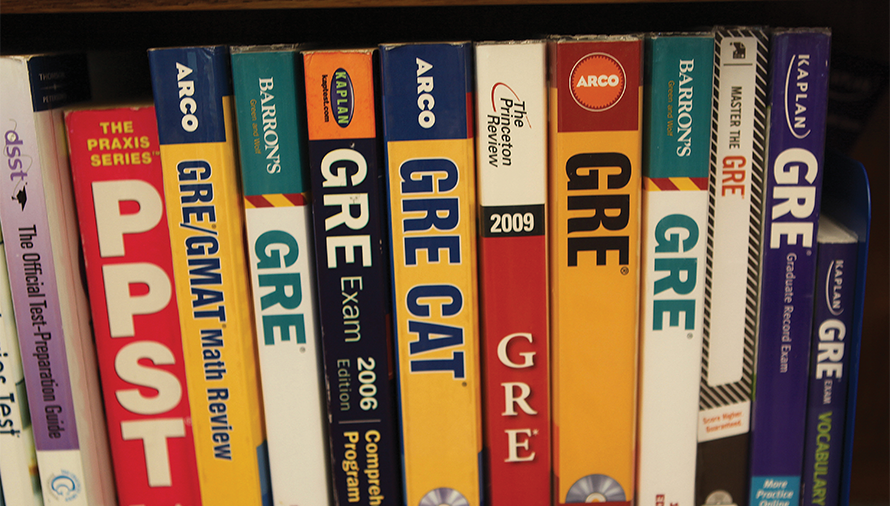
What are the coordinates of `the fourth book from left side of image` in the screenshot? It's located at (240, 487).